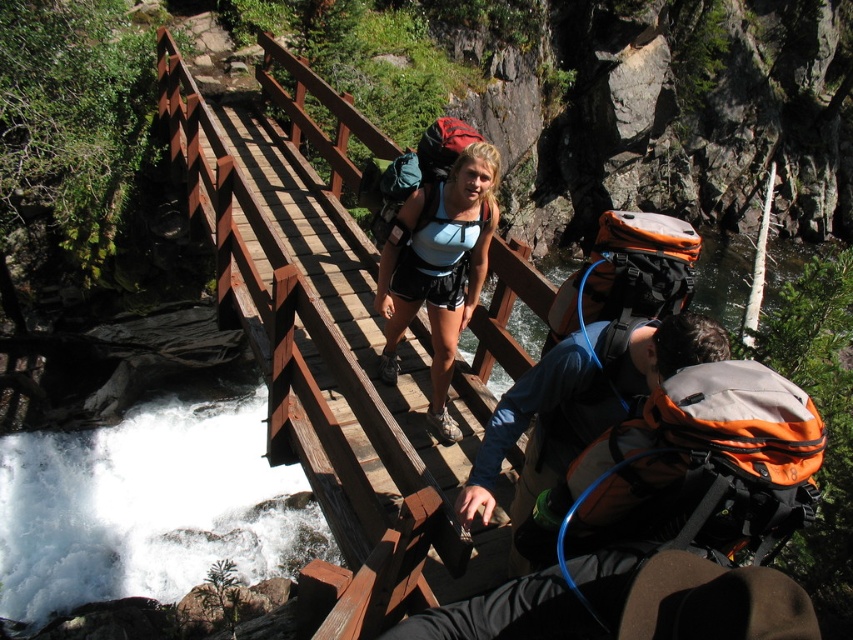
Question: Among these points, which one is farthest from the camera?

Choices:
 (A) (582, 429)
 (B) (442, 184)

Answer: (B)

Question: In this image, where is brown wooden bridge at center located relative to orange fabric backpack at center?

Choices:
 (A) left
 (B) right

Answer: (A)

Question: Is brown wooden bridge at center positioned in front of matte blue fabric backpack at center?

Choices:
 (A) no
 (B) yes

Answer: (A)

Question: Can you confirm if orange fabric backpack at center is smaller than matte blue fabric backpack at center?

Choices:
 (A) no
 (B) yes

Answer: (B)

Question: Which of the following is the farthest from the observer?

Choices:
 (A) (703, 323)
 (B) (440, 388)
 (C) (422, 381)

Answer: (C)

Question: Which point appears farthest from the camera in this image?

Choices:
 (A) (311, 138)
 (B) (450, 305)

Answer: (A)